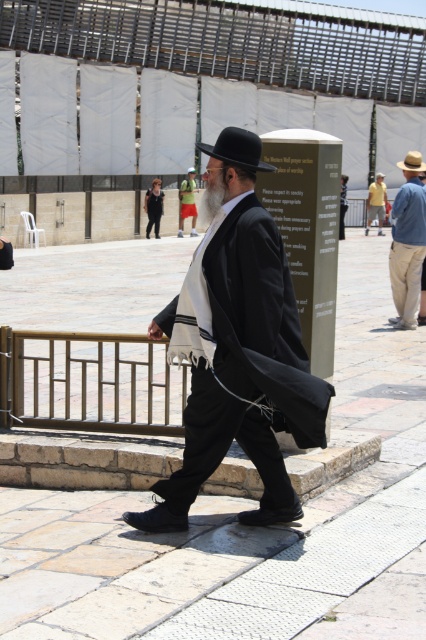
Question: Among these objects, which one is farthest from the camera?

Choices:
 (A) yellow cotton shirt at upper right
 (B) green jersey at center

Answer: (A)

Question: Can you confirm if denim pants at right is thinner than black woolen robe at center?

Choices:
 (A) yes
 (B) no

Answer: (A)

Question: In this image, where is smooth stone pavement at center located relative to denim pants at right?

Choices:
 (A) left
 (B) right

Answer: (A)

Question: Does smooth stone pavement at center appear on the left side of silky black robe at center?

Choices:
 (A) yes
 (B) no

Answer: (A)

Question: Estimate the real-world distances between objects in this image. Which object is farther from the yellow cotton shirt at upper right?

Choices:
 (A) black woolen robe at center
 (B) green jersey at center

Answer: (A)

Question: Which point is farther to the camera?

Choices:
 (A) [x=146, y=189]
 (B) [x=371, y=212]
 (C) [x=342, y=180]
 (D) [x=190, y=195]

Answer: (C)